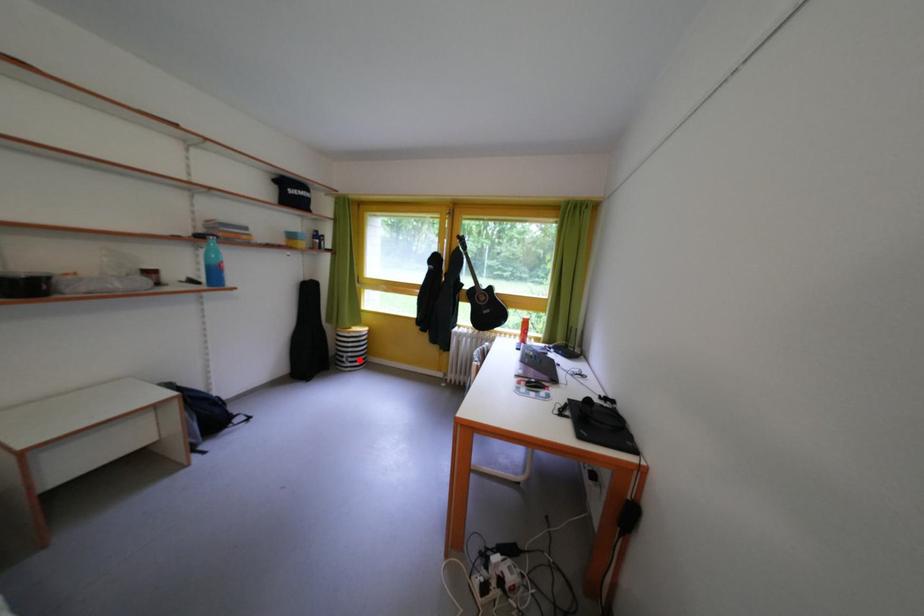
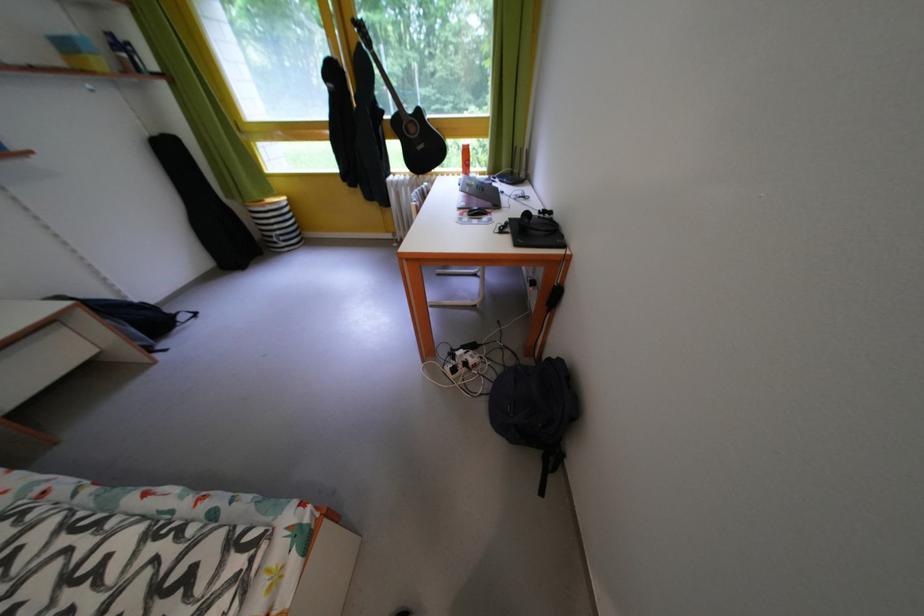
Question: I am providing you with two images of the same scene from different viewpoints. A red point is shown in image1. For the corresponding object point in image2, is it positioned nearer or farther from the camera?

Choices:
 (A) Nearer
 (B) Farther

Answer: (B)